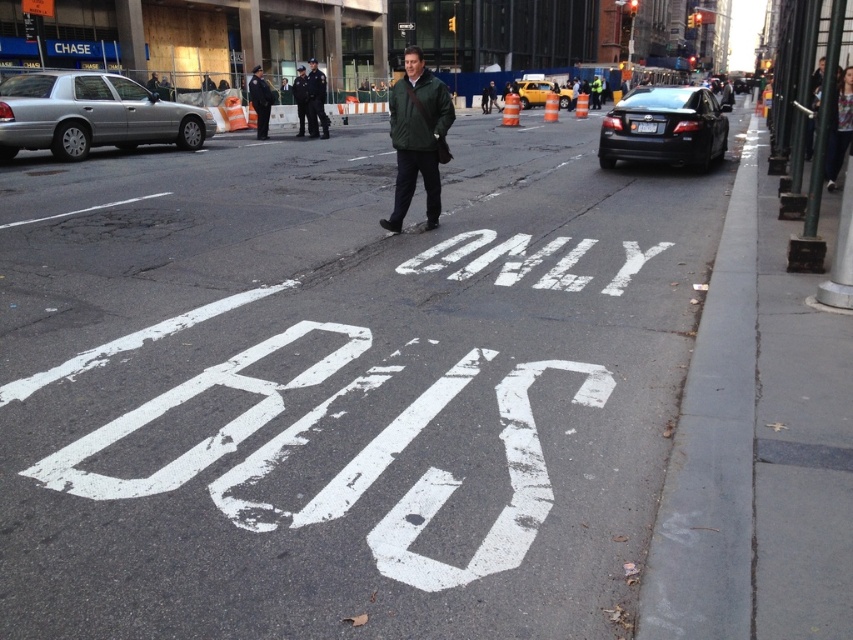
In the scene shown: You are a pedestrian standing at the center of the ONLY BUS lane. You see a dark blue uniform at center and a yellow matte taxi at center. Which object is closer to the ground?

The dark blue uniform at center is below the yellow matte taxi at center, so the dark blue uniform at center is closer to the ground.

In the scene shown: You are a delivery person who needs to determine if your 6.5 feet tall delivery box can fit between the dark blue uniform at center and the yellow matte taxi at center. Can you fit the box between them?

The dark blue uniform at center is taller than the yellow matte taxi at center. Since the delivery box is 6.5 feet tall, and the shorter object is the yellow matte taxi at center, the box may not fit vertically unless the taxi is higher. However, since the uniform is taller, the minimum height available is determined by the taxi. If the taxi is under 6.5 feet, it won 9t fit. But based on the description, the uniform is taller, so the taxi might be shorter than the box. Without exact measurements, it 9sunc

You are a delivery driver who needs to park your van near the Chase bank branch. You see a silver metallic sedan at left and a yellow matte taxi at center. Which vehicle is closer to the Chase bank branch?

The yellow matte taxi at center is closer to the Chase bank branch because the silver metallic sedan at left is to the left of it, meaning the taxi is between the sedan and the bank.